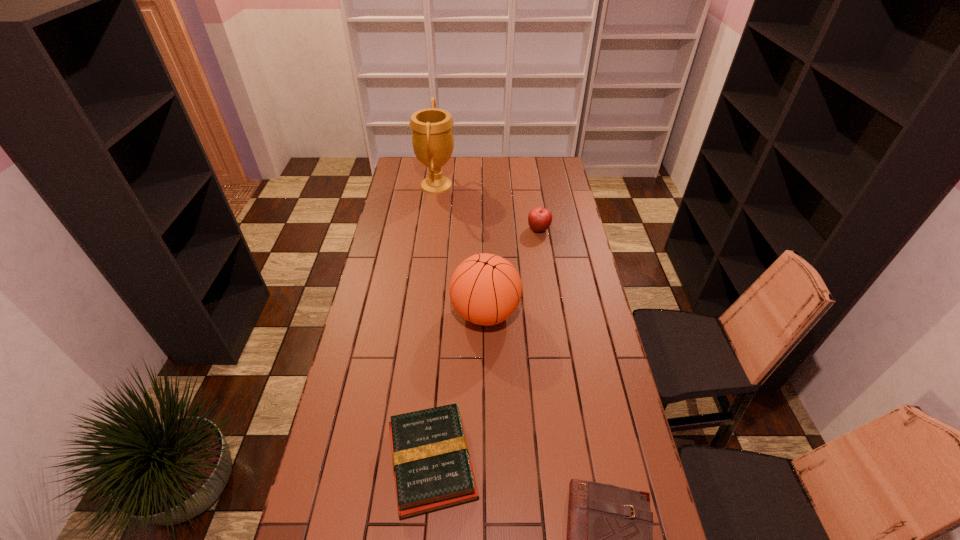
The image size is (960, 540). I want to click on free space that is in between the apple and the tallest object, so click(488, 207).

Find the location of a particular element. The width and height of the screenshot is (960, 540). vacant point located between the trophy and the second shortest object is located at coordinates (434, 323).

The image size is (960, 540). I want to click on object that is the fourth closest to the second farthest object, so click(609, 539).

Locate which object is the fourth closest to the third shortest object. Please provide its 2D coordinates. Your answer should be formatted as a tuple, i.e. [(x, y)], where the tuple contains the x and y coordinates of a point satisfying the conditions above.

[(609, 539)]

Where is `free space that satisfies the following two spatial constraints: 1. on the engravings side of the fourth tallest object; 2. on the left side of the trophy`? This screenshot has width=960, height=540. free space that satisfies the following two spatial constraints: 1. on the engravings side of the fourth tallest object; 2. on the left side of the trophy is located at coordinates (400, 462).

Image resolution: width=960 pixels, height=540 pixels. Identify the location of vacant space that satisfies the following two spatial constraints: 1. on the engravings side of the second farthest object; 2. on the right side of the trophy. pyautogui.click(x=431, y=230).

In order to click on free space that satisfies the following two spatial constraints: 1. on the engravings side of the tallest object; 2. on the left side of the second shortest object in this screenshot , I will do `click(400, 462)`.

I want to click on vacant region that satisfies the following two spatial constraints: 1. on the back side of the third shortest object; 2. on the engravings side of the tallest object, so click(x=532, y=185).

Find the location of `free region that satisfies the following two spatial constraints: 1. on the engravings side of the tallest object; 2. on the back side of the apple`. free region that satisfies the following two spatial constraints: 1. on the engravings side of the tallest object; 2. on the back side of the apple is located at coordinates (431, 230).

The width and height of the screenshot is (960, 540). What are the coordinates of `vacant point that satisfies the following two spatial constraints: 1. on the back side of the left hardback book; 2. on the engravings side of the tallest object` in the screenshot? It's located at (454, 185).